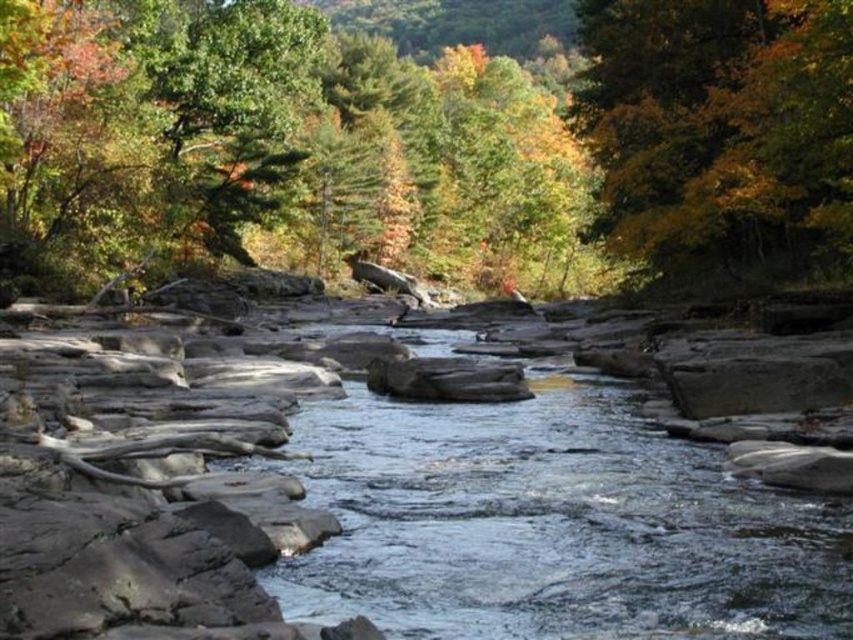
Please look at the image and identify the object located at the coordinates point (422, 145). Which object is it?

The point (422, 145) indicates the green matte tree at upper center.